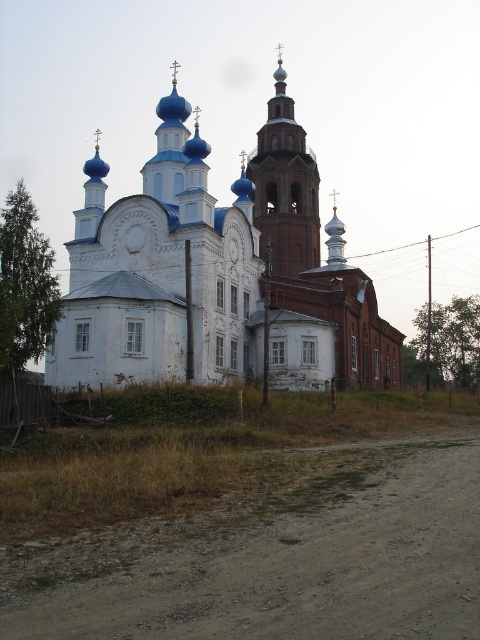
You are standing in front of the church and want to take a photo of both the white wooden church at center and the smooth brown tower at center. Which one should you frame first in your camera viewfinder to ensure both are captured in the same shot?

You should frame the smooth brown tower at center first because the white wooden church at center is positioned to its right, so starting with the tower allows you to include both in the same shot.